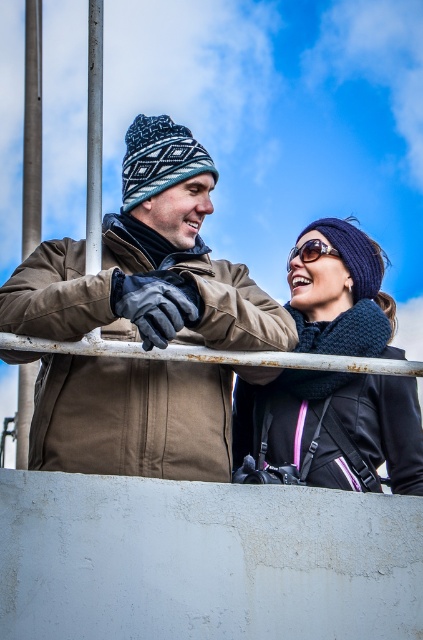
Between smooth silver pole at left and sunglasses at center, which one is positioned higher?

smooth silver pole at left is above.

Locate an element on the screen. The width and height of the screenshot is (423, 640). smooth silver pole at left is located at coordinates (32, 129).

Locate an element on the screen. The image size is (423, 640). smooth silver pole at left is located at coordinates (32, 129).

Does smooth silver pole at left have a larger size compared to smooth metal pole at upper left?

Yes.

From the picture: Which of these two, smooth silver pole at left or smooth metal pole at upper left, stands taller?

With more height is smooth silver pole at left.

Locate an element on the screen. The image size is (423, 640). smooth silver pole at left is located at coordinates (32, 129).

This screenshot has height=640, width=423. Find the location of `smooth silver pole at left`. smooth silver pole at left is located at coordinates (32, 129).

Based on the photo, can you confirm if knitted dark blue scarf at upper right is taller than smooth silver pole at left?

Incorrect, knitted dark blue scarf at upper right's height is not larger of smooth silver pole at left's.

This screenshot has height=640, width=423. What are the coordinates of `knitted dark blue scarf at upper right` in the screenshot? It's located at (337, 419).